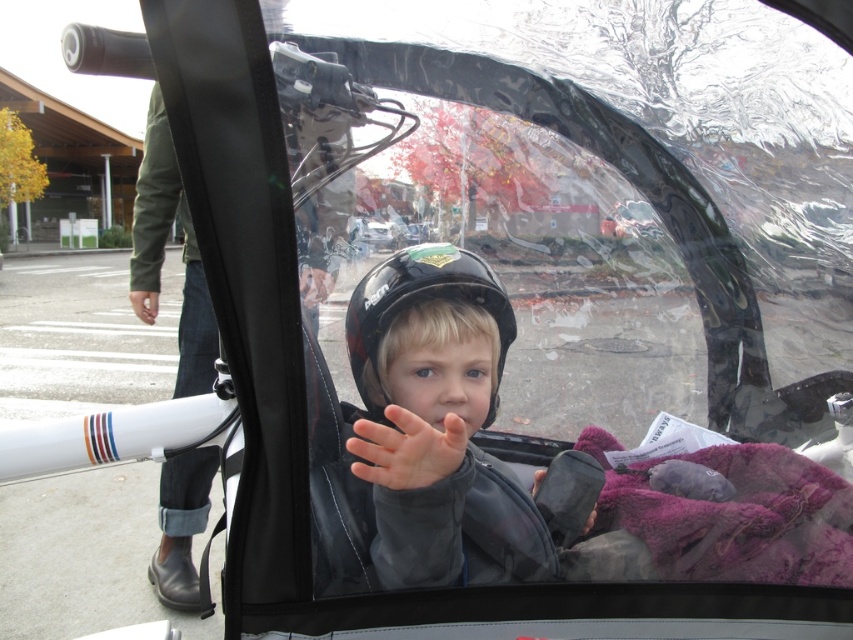
Which is in front, point (129, 264) or point (421, 272)?

Positioned in front is point (421, 272).

Find the location of a particular element. black leather boot at left is located at coordinates (163, 256).

Who is shorter, black leather boot at left or black matte glove at center?

Standing shorter between the two is black matte glove at center.

Is black leather boot at left thinner than black matte glove at center?

No.

Who is more distant from viewer, (154, 588) or (532, 486)?

Positioned behind is point (154, 588).

Image resolution: width=853 pixels, height=640 pixels. Identify the location of black leather boot at left. (163, 256).

Between metallic silver car at center and black matte glove at center, which one is positioned higher?

metallic silver car at center is above.

Does metallic silver car at center have a greater width compared to black matte glove at center?

Indeed, metallic silver car at center has a greater width compared to black matte glove at center.

Does point (631, 216) come farther from viewer compared to point (534, 484)?

Yes, it is behind point (534, 484).

Where is `metallic silver car at center`? metallic silver car at center is located at coordinates (631, 220).